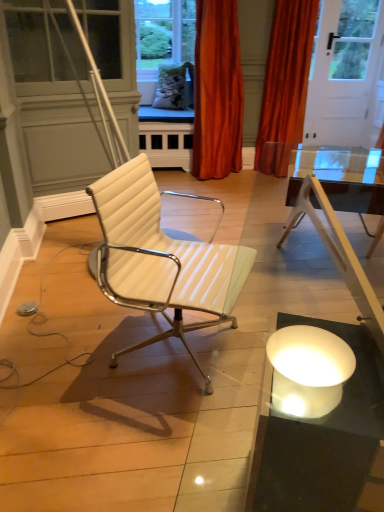
Question: Is orange velvet curtain at upper center, acting as the first curtain starting from the left, thinner than white leather chair at center?

Choices:
 (A) yes
 (B) no

Answer: (A)

Question: Can you confirm if orange velvet curtain at upper center, acting as the first curtain starting from the left, is positioned to the right of white leather chair at center?

Choices:
 (A) no
 (B) yes

Answer: (B)

Question: Is orange velvet curtain at upper center, which is the second curtain from right to left, behind white leather chair at center?

Choices:
 (A) no
 (B) yes

Answer: (B)

Question: Does orange velvet curtain at upper center, acting as the first curtain starting from the left, have a lesser height compared to white leather chair at center?

Choices:
 (A) no
 (B) yes

Answer: (A)

Question: Is orange velvet curtain at upper center, which is the second curtain from right to left, positioned before white leather chair at center?

Choices:
 (A) yes
 (B) no

Answer: (B)

Question: Do you think orange velvet curtain at upper right, the second curtain when ordered from left to right, is within orange velvet curtain at upper center, which is the second curtain from right to left, or outside of it?

Choices:
 (A) outside
 (B) inside

Answer: (A)

Question: From a real-world perspective, relative to orange velvet curtain at upper center, acting as the first curtain starting from the left, is orange velvet curtain at upper right, acting as the 1th curtain starting from the right, vertically above or below?

Choices:
 (A) above
 (B) below

Answer: (A)

Question: Would you say orange velvet curtain at upper right, acting as the 1th curtain starting from the right, is to the left or to the right of orange velvet curtain at upper center, acting as the first curtain starting from the left, in the picture?

Choices:
 (A) left
 (B) right

Answer: (B)

Question: Relative to orange velvet curtain at upper center, acting as the first curtain starting from the left, is orange velvet curtain at upper right, acting as the 1th curtain starting from the right, in front or behind?

Choices:
 (A) front
 (B) behind

Answer: (B)

Question: Considering the positions of white leather chair at center and orange velvet curtain at upper right, acting as the 1th curtain starting from the right, in the image, is white leather chair at center wider or thinner than orange velvet curtain at upper right, acting as the 1th curtain starting from the right,?

Choices:
 (A) wide
 (B) thin

Answer: (A)

Question: Is white leather chair at center situated inside orange velvet curtain at upper right, the second curtain when ordered from left to right, or outside?

Choices:
 (A) inside
 (B) outside

Answer: (B)

Question: Does point (208, 387) appear closer or farther from the camera than point (274, 79)?

Choices:
 (A) closer
 (B) farther

Answer: (A)

Question: From the image's perspective, is white leather chair at center located above or below orange velvet curtain at upper right, acting as the 1th curtain starting from the right?

Choices:
 (A) above
 (B) below

Answer: (B)

Question: Is point (190, 287) positioned closer to the camera than point (196, 17)?

Choices:
 (A) closer
 (B) farther

Answer: (A)

Question: In the image, is white leather chair at center on the left side or the right side of orange velvet curtain at upper center, acting as the first curtain starting from the left?

Choices:
 (A) left
 (B) right

Answer: (A)